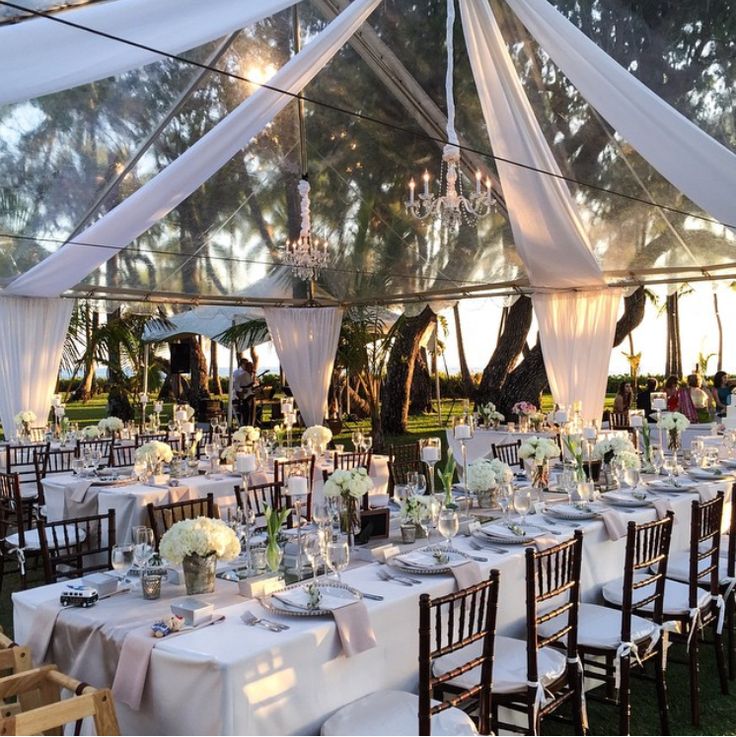
The height and width of the screenshot is (737, 736). Find the location of `event tables`. event tables is located at coordinates (314, 629), (141, 482), (92, 440), (486, 430), (700, 430).